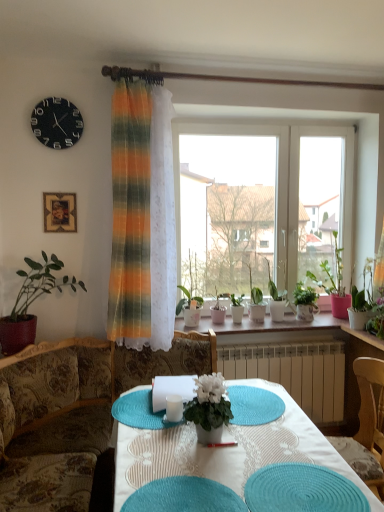
The image size is (384, 512). Find the location of `blank space above teal woven placemat at center (from a real-world perspective)`. blank space above teal woven placemat at center (from a real-world perspective) is located at coordinates (181, 493).